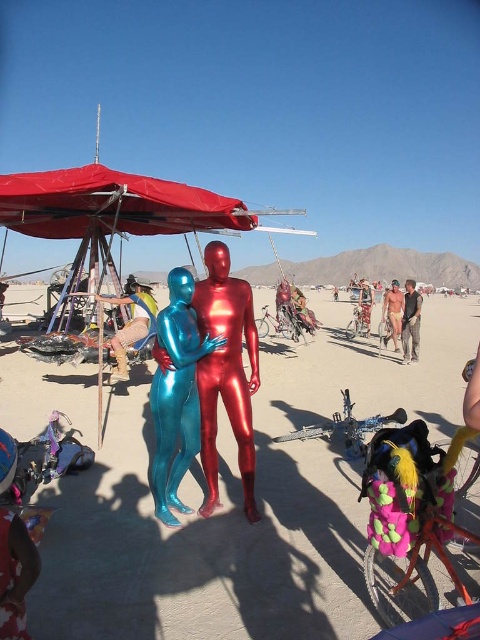
Can you confirm if red matte umbrella at center is positioned to the right of metallic blue suit at lower left?

In fact, red matte umbrella at center is to the left of metallic blue suit at lower left.

Between point (205, 212) and point (21, 627), which one is positioned in front?

Point (21, 627) is more forward.

Locate an element on the screen. red matte umbrella at center is located at coordinates (111, 205).

Is the position of red matte umbrella at center less distant than that of matte khaki pants at center?

That is True.

Is point (173, 193) positioned before point (417, 358)?

Yes, it is in front of point (417, 358).

Where is `red matte umbrella at center`? Image resolution: width=480 pixels, height=640 pixels. red matte umbrella at center is located at coordinates (111, 205).

Does point (134, 220) lie behind point (385, 307)?

No, it is not.

Between point (68, 188) and point (386, 305), which one is positioned behind?

Positioned behind is point (386, 305).

Where is `red matte umbrella at center`? Image resolution: width=480 pixels, height=640 pixels. red matte umbrella at center is located at coordinates (111, 205).